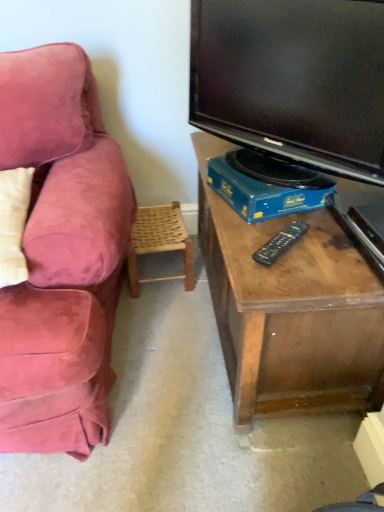
Measure the distance between black plastic remote at center and camera.

96.60 centimeters.

Measure the distance between black glossy tv at upper right and camera.

black glossy tv at upper right is 34.17 inches away from camera.

At what (x,y) coordinates should I click in order to perform the action: click on black plastic remote at center. Please return your answer as a coordinate pair (x, y). Looking at the image, I should click on (280, 243).

From a real-world perspective, is black glossy tv at upper right physically below woven wood chair at lower center?

No.

Which of these two, black glossy tv at upper right or woven wood chair at lower center, is thinner?

Thinner between the two is black glossy tv at upper right.

Considering the sizes of black glossy tv at upper right and woven wood chair at lower center in the image, is black glossy tv at upper right taller or shorter than woven wood chair at lower center?

Considering their sizes, black glossy tv at upper right has more height than woven wood chair at lower center.

Between black glossy tv at upper right and woven wood chair at lower center, which one appears on the left side from the viewer's perspective?

woven wood chair at lower center.

In the image, is blue cardboard box at lower center on the left side or the right side of black glossy tv at upper right?

Clearly, blue cardboard box at lower center is on the left of black glossy tv at upper right in the image.

Which of these two, blue cardboard box at lower center or black glossy tv at upper right, stands shorter?

With less height is blue cardboard box at lower center.

Is blue cardboard box at lower center oriented towards black glossy tv at upper right?

No, blue cardboard box at lower center is not aimed at black glossy tv at upper right.

Which of these two, blue cardboard box at lower center or black glossy tv at upper right, is thinner?

With smaller width is black glossy tv at upper right.

From a real-world perspective, which is physically above, woven wood chair at lower center or blue cardboard box at lower center?

From a 3D spatial view, blue cardboard box at lower center is above.

Is woven wood chair at lower center located outside blue cardboard box at lower center?

That's correct, woven wood chair at lower center is outside of blue cardboard box at lower center.

Which object is closer to the camera taking this photo, woven wood chair at lower center or blue cardboard box at lower center?

blue cardboard box at lower center is in front.

Find the location of `chair below the blue cardboard box at lower center (from the image's perspective)`. chair below the blue cardboard box at lower center (from the image's perspective) is located at coordinates (159, 242).

From the image's perspective, which object appears higher, black glossy tv at upper right or blue cardboard box at lower center?

black glossy tv at upper right, from the image's perspective.

Does black glossy tv at upper right have a lesser width compared to blue cardboard box at lower center?

Yes, black glossy tv at upper right is thinner than blue cardboard box at lower center.

Does point (213, 10) come farther from viewer compared to point (248, 203)?

Yes.

Does black plastic remote at center appear on the right side of woven wood chair at lower center?

Yes.

Does black plastic remote at center contain woven wood chair at lower center?

No.

Locate an element on the screen. The image size is (384, 512). remote on the right of woven wood chair at lower center is located at coordinates (280, 243).

Looking at this image, from a real-world perspective, is black plastic remote at center on top of woven wood chair at lower center?

Yes, from a real-world perspective, black plastic remote at center is above woven wood chair at lower center.

This screenshot has width=384, height=512. Identify the location of remote behind the black glossy tv at upper right. (280, 243).

Considering the relative sizes of black plastic remote at center and black glossy tv at upper right in the image provided, is black plastic remote at center thinner than black glossy tv at upper right?

No, black plastic remote at center is not thinner than black glossy tv at upper right.

From a real-world perspective, which object stands above the other?

black glossy tv at upper right.

How far apart are black plastic remote at center and black glossy tv at upper right?

black plastic remote at center and black glossy tv at upper right are 38.65 centimeters apart.

Considering the relative sizes of blue cardboard box at lower center and black plastic remote at center in the image provided, is blue cardboard box at lower center taller than black plastic remote at center?

Indeed, blue cardboard box at lower center has a greater height compared to black plastic remote at center.

Between blue cardboard box at lower center and black plastic remote at center, which one has smaller size?

black plastic remote at center.

Which of these two, blue cardboard box at lower center or black plastic remote at center, is wider?

Wider between the two is blue cardboard box at lower center.

Where is `remote that appears below the blue cardboard box at lower center (from the image's perspective)`? remote that appears below the blue cardboard box at lower center (from the image's perspective) is located at coordinates (280, 243).

Find the location of a particular element. television lying above the woven wood chair at lower center (from the image's perspective) is located at coordinates (293, 80).

Identify the location of book on the left of black glossy tv at upper right. (260, 194).

Based on their spatial positions, is black glossy tv at upper right or black plastic remote at center closer to woven wood chair at lower center?

black glossy tv at upper right.

Looking at the image, which one is located further to woven wood chair at lower center, black plastic remote at center or blue cardboard box at lower center?

Among the two, black plastic remote at center is located further to woven wood chair at lower center.

When comparing their distances from black plastic remote at center, does black glossy tv at upper right or blue cardboard box at lower center seem closer?

Among the two, blue cardboard box at lower center is located nearer to black plastic remote at center.

From the picture: When comparing their distances from woven wood chair at lower center, does black glossy tv at upper right or blue cardboard box at lower center seem closer?

The object closer to woven wood chair at lower center is blue cardboard box at lower center.

Looking at the image, which one is located further to black glossy tv at upper right, woven wood chair at lower center or black plastic remote at center?

woven wood chair at lower center is further to black glossy tv at upper right.

Looking at the image, which one is located further to black glossy tv at upper right, blue cardboard box at lower center or woven wood chair at lower center?

Among the two, woven wood chair at lower center is located further to black glossy tv at upper right.

Based on their spatial positions, is blue cardboard box at lower center or black plastic remote at center closer to woven wood chair at lower center?

Among the two, blue cardboard box at lower center is located nearer to woven wood chair at lower center.

Which object lies nearer to the anchor point blue cardboard box at lower center, black glossy tv at upper right or black plastic remote at center?

black plastic remote at center.

Identify the location of book between black glossy tv at upper right and woven wood chair at lower center from front to back. (260, 194).

I want to click on remote between black glossy tv at upper right and woven wood chair at lower center along the z-axis, so [280, 243].

Find the location of a particular element. The width and height of the screenshot is (384, 512). book positioned between black plastic remote at center and woven wood chair at lower center from near to far is located at coordinates (260, 194).

What are the coordinates of `book between black glossy tv at upper right and black plastic remote at center in the vertical direction` in the screenshot? It's located at pos(260,194).